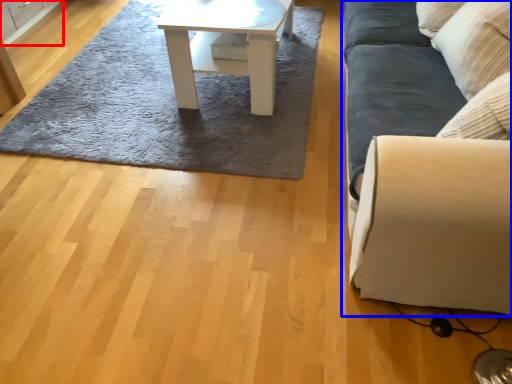
Question: Which object is closer to the camera taking this photo, cabinetry (highlighted by a red box) or studio couch (highlighted by a blue box)?

Choices:
 (A) cabinetry
 (B) studio couch

Answer: (B)